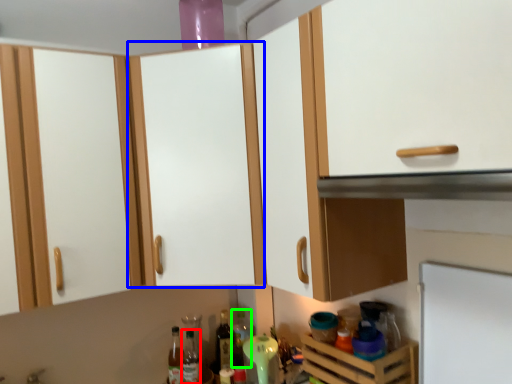
Question: Which object is positioned farthest from bottle (highlighted by a red box)? Select from cabinetry (highlighted by a blue box) and bottle (highlighted by a green box).

Choices:
 (A) cabinetry
 (B) bottle

Answer: (A)